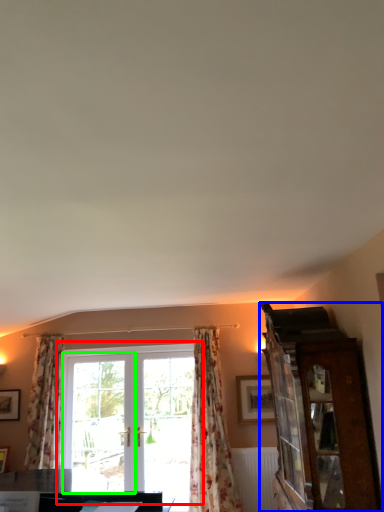
Question: Which object is the farthest from window (highlighted by a red box)? Choose among these: cabinetry (highlighted by a blue box) or screen door (highlighted by a green box).

Choices:
 (A) cabinetry
 (B) screen door

Answer: (A)